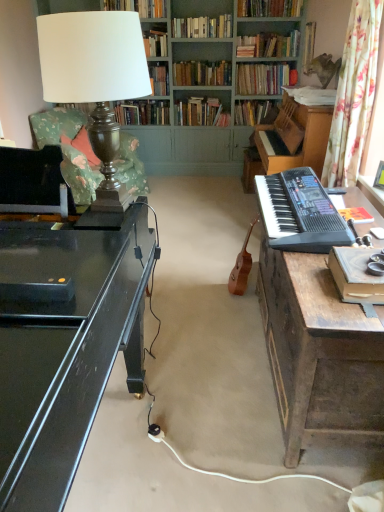
Question: Is floral fabric swivel chair at left bigger than hardcover book at upper center, the eighth book viewed from the front?

Choices:
 (A) yes
 (B) no

Answer: (A)

Question: Is floral fabric swivel chair at left positioned in front of hardcover book at upper center, the eighth book viewed from the front?

Choices:
 (A) yes
 (B) no

Answer: (A)

Question: Is floral fabric swivel chair at left aimed at hardcover book at upper center, the eighth book viewed from the front?

Choices:
 (A) no
 (B) yes

Answer: (A)

Question: Can you confirm if floral fabric swivel chair at left is taller than hardcover book at upper center, positioned as the 5th book in back-to-front order?

Choices:
 (A) no
 (B) yes

Answer: (B)

Question: Considering the relative sizes of floral fabric swivel chair at left and hardcover book at upper center, positioned as the 5th book in back-to-front order, in the image provided, is floral fabric swivel chair at left wider than hardcover book at upper center, positioned as the 5th book in back-to-front order,?

Choices:
 (A) no
 (B) yes

Answer: (B)

Question: Would you say floral fabric curtain at right is to the left or to the right of wooden book at right, which is the twelfth book from back to front, in the picture?

Choices:
 (A) right
 (B) left

Answer: (A)

Question: Is point [357, 117] closer or farther from the camera than point [342, 296]?

Choices:
 (A) closer
 (B) farther

Answer: (B)

Question: Considering the positions of floral fabric curtain at right and wooden book at right, which is the twelfth book from back to front, in the image, is floral fabric curtain at right wider or thinner than wooden book at right, which is the twelfth book from back to front,?

Choices:
 (A) thin
 (B) wide

Answer: (B)

Question: Is floral fabric curtain at right in front of or behind wooden book at right, which is the twelfth book from back to front, in the image?

Choices:
 (A) behind
 (B) front

Answer: (A)

Question: Considering the relative positions of hardcover book at center, which is the tenth book from front to back, and hardcover book at center, which appears as the 12th book when viewed from the front, in the image provided, is hardcover book at center, which is the tenth book from front to back, to the left or to the right of hardcover book at center, which appears as the 12th book when viewed from the front,?

Choices:
 (A) right
 (B) left

Answer: (A)

Question: Would you say hardcover book at center, which is the tenth book from front to back, is inside or outside hardcover book at center, arranged as the first book when viewed from the back?

Choices:
 (A) outside
 (B) inside

Answer: (A)

Question: In terms of height, does hardcover book at center, which is the tenth book from front to back, look taller or shorter compared to hardcover book at center, which appears as the 12th book when viewed from the front?

Choices:
 (A) tall
 (B) short

Answer: (A)

Question: Considering the positions of hardcover book at center, which appears as the 3th book when viewed from the back, and hardcover book at center, arranged as the first book when viewed from the back, in the image, is hardcover book at center, which appears as the 3th book when viewed from the back, bigger or smaller than hardcover book at center, arranged as the first book when viewed from the back,?

Choices:
 (A) big
 (B) small

Answer: (A)

Question: Is hardcover book at upper right, the 11th book when ordered from back to front, inside or outside of hardcover book at center, the seventh book in the front-to-back sequence?

Choices:
 (A) inside
 (B) outside

Answer: (B)

Question: Does point (322, 95) appear closer or farther from the camera than point (286, 74)?

Choices:
 (A) closer
 (B) farther

Answer: (A)